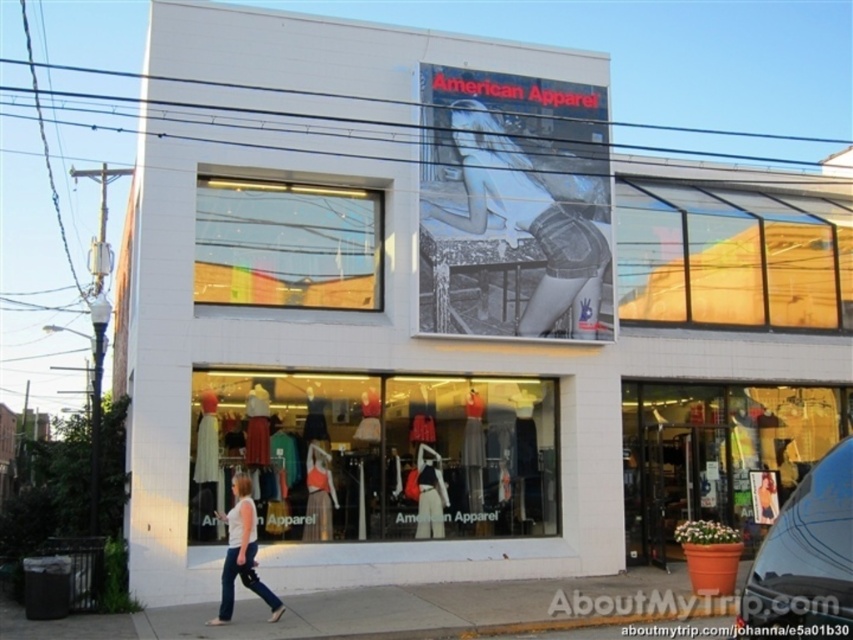
You are a delivery person trying to place a large box on the ground in front of the American Apparel store. The box requires a flat surface that is at least as big as the transparent glass at center. Can you use the smooth concrete sidewalk at lower center for this purpose?

The smooth concrete sidewalk at lower center has a larger size compared to the transparent glass at center, so yes, the delivery person can use the smooth concrete sidewalk at lower center to place the large box since it is sufficiently large enough to accommodate the required size.

You are a customer standing outside the American Apparel store. You see the matte glass display at center and the white cotton shirt at lower center. Which object is bigger in size?

The matte glass display at center is larger in size than the white cotton shirt at lower center.